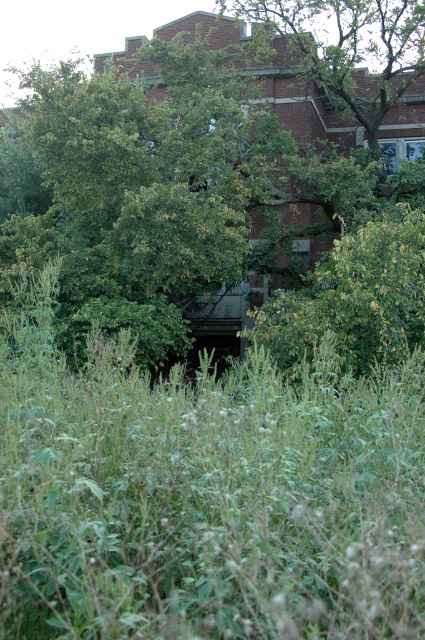
You are a gardener who wants to trim the plants in the image. Which of the two plants, the green leafy tree at center or the green leafy grass at center, will require a ladder to reach its top?

The green leafy tree at center is much taller than the green leafy grass at center, so the gardener will need a ladder to reach its top.